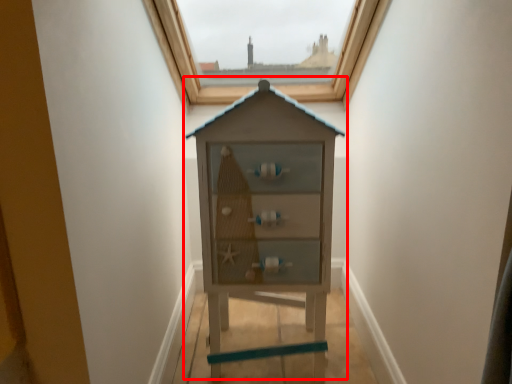
Question: From the image's perspective, what is the correct spatial relationship of dresser (annotated by the red box) in relation to window?

Choices:
 (A) below
 (B) above

Answer: (A)